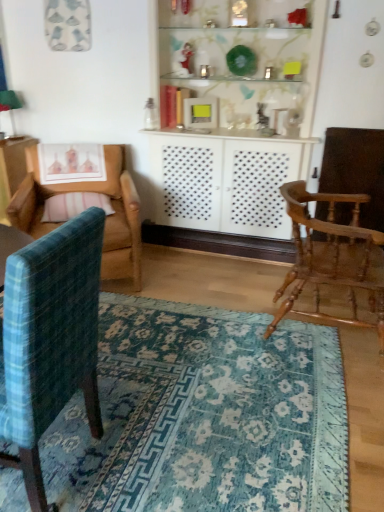
Where is `blue woven rug at lower center`? This screenshot has height=512, width=384. blue woven rug at lower center is located at coordinates (204, 416).

Image resolution: width=384 pixels, height=512 pixels. What do you see at coordinates (106, 219) in the screenshot?
I see `wooden armchair at left, the third chair viewed from the right` at bounding box center [106, 219].

The image size is (384, 512). Describe the element at coordinates (74, 205) in the screenshot. I see `pink striped pillow at left` at that location.

Describe the element at coordinates (333, 256) in the screenshot. The width and height of the screenshot is (384, 512). I see `wooden rocking chair at right, the 1th chair positioned from the right` at that location.

Image resolution: width=384 pixels, height=512 pixels. Find the location of `teal plaid chair at left, which is the second chair in right-to-left order`. teal plaid chair at left, which is the second chair in right-to-left order is located at coordinates (50, 340).

Where is `blue woven rug at lower center`? blue woven rug at lower center is located at coordinates (204, 416).

Considering the sizes of pink striped pillow at left and blue woven rug at lower center in the image, is pink striped pillow at left wider or thinner than blue woven rug at lower center?

In the image, pink striped pillow at left appears to be more narrow than blue woven rug at lower center.

From a real-world perspective, is pink striped pillow at left located beneath blue woven rug at lower center?

Actually, pink striped pillow at left is physically above blue woven rug at lower center in the real world.

From the image's perspective, is pink striped pillow at left beneath blue woven rug at lower center?

No, from the image's perspective, pink striped pillow at left is not beneath blue woven rug at lower center.

Is blue woven rug at lower center surrounded by pink striped pillow at left?

No, blue woven rug at lower center is not inside pink striped pillow at left.

Find the location of a particular element. chair that is the 1st one above the blue woven rug at lower center (from a real-world perspective) is located at coordinates (333, 256).

Does wooden rocking chair at right, placed as the third chair when sorted from left to right, have a larger size compared to blue woven rug at lower center?

Indeed, wooden rocking chair at right, placed as the third chair when sorted from left to right, has a larger size compared to blue woven rug at lower center.

Between wooden rocking chair at right, the 1th chair positioned from the right, and blue woven rug at lower center, which one appears on the right side from the viewer's perspective?

From the viewer's perspective, wooden rocking chair at right, the 1th chair positioned from the right, appears more on the right side.

From a real-world perspective, is wooden rocking chair at right, the 1th chair positioned from the right, positioned above or below blue woven rug at lower center?

From a real-world perspective, wooden rocking chair at right, the 1th chair positioned from the right, is physically above blue woven rug at lower center.

Considering the relative sizes of wooden rocking chair at right, the 1th chair positioned from the right, and wooden armchair at left, the third chair viewed from the right, in the image provided, is wooden rocking chair at right, the 1th chair positioned from the right, taller than wooden armchair at left, the third chair viewed from the right,?

In fact, wooden rocking chair at right, the 1th chair positioned from the right, may be shorter than wooden armchair at left, the third chair viewed from the right.

Looking at this image, who is smaller, wooden rocking chair at right, placed as the third chair when sorted from left to right, or wooden armchair at left, the third chair viewed from the right?

With smaller size is wooden rocking chair at right, placed as the third chair when sorted from left to right.

Is point (304, 191) closer or farther from the camera than point (118, 253)?

Point (304, 191) is positioned closer to the camera compared to point (118, 253).

In the image, is wooden rocking chair at right, the 1th chair positioned from the right, on the left side or the right side of wooden armchair at left, acting as the first chair starting from the left?

In the image, wooden rocking chair at right, the 1th chair positioned from the right, appears on the right side of wooden armchair at left, acting as the first chair starting from the left.

From the image's perspective, which one is positioned lower, wooden rocking chair at right, the 1th chair positioned from the right, or pink striped pillow at left?

wooden rocking chair at right, the 1th chair positioned from the right, from the image's perspective.

Considering the relative sizes of wooden rocking chair at right, the 1th chair positioned from the right, and pink striped pillow at left in the image provided, is wooden rocking chair at right, the 1th chair positioned from the right, shorter than pink striped pillow at left?

No, wooden rocking chair at right, the 1th chair positioned from the right, is not shorter than pink striped pillow at left.

Considering the relative sizes of wooden rocking chair at right, the 1th chair positioned from the right, and pink striped pillow at left in the image provided, is wooden rocking chair at right, the 1th chair positioned from the right, thinner than pink striped pillow at left?

Incorrect, the width of wooden rocking chair at right, the 1th chair positioned from the right, is not less than that of pink striped pillow at left.

From a real-world perspective, is wooden rocking chair at right, placed as the third chair when sorted from left to right, positioned above or below pink striped pillow at left?

wooden rocking chair at right, placed as the third chair when sorted from left to right, is situated lower than pink striped pillow at left in the real world.

Based on their sizes in the image, would you say blue woven rug at lower center is bigger or smaller than wooden rocking chair at right, the 1th chair positioned from the right?

Considering their sizes, blue woven rug at lower center takes up less space than wooden rocking chair at right, the 1th chair positioned from the right.

Considering the relative sizes of blue woven rug at lower center and wooden rocking chair at right, the 1th chair positioned from the right, in the image provided, is blue woven rug at lower center taller than wooden rocking chair at right, the 1th chair positioned from the right,?

Incorrect, the height of blue woven rug at lower center is not larger of that of wooden rocking chair at right, the 1th chair positioned from the right.

Consider the image. Can you confirm if blue woven rug at lower center is thinner than wooden rocking chair at right, placed as the third chair when sorted from left to right?

In fact, blue woven rug at lower center might be wider than wooden rocking chair at right, placed as the third chair when sorted from left to right.

Between point (327, 327) and point (321, 263), which one is positioned in front?

Positioned in front is point (321, 263).

Looking at this image, from a real-world perspective, which object rests below the other?

From a 3D spatial view, pink striped pillow at left is below.

From the image's perspective, is teal plaid chair at left, placed as the 2th chair when sorted from left to right, beneath pink striped pillow at left?

Indeed, from the image's perspective, teal plaid chair at left, placed as the 2th chair when sorted from left to right, is shown beneath pink striped pillow at left.

Which object is positioned more to the right, teal plaid chair at left, placed as the 2th chair when sorted from left to right, or pink striped pillow at left?

Positioned to the right is teal plaid chair at left, placed as the 2th chair when sorted from left to right.

Considering the relative sizes of teal plaid chair at left, which is the second chair in right-to-left order, and pink striped pillow at left in the image provided, is teal plaid chair at left, which is the second chair in right-to-left order, wider than pink striped pillow at left?

Yes.

Between wooden armchair at left, the third chair viewed from the right, and wooden rocking chair at right, the 1th chair positioned from the right, which one has more height?

With more height is wooden armchair at left, the third chair viewed from the right.

Does wooden armchair at left, acting as the first chair starting from the left, turn towards wooden rocking chair at right, the 1th chair positioned from the right?

No.

Looking at this image, can you confirm if wooden armchair at left, the third chair viewed from the right, is thinner than wooden rocking chair at right, the 1th chair positioned from the right?

In fact, wooden armchair at left, the third chair viewed from the right, might be wider than wooden rocking chair at right, the 1th chair positioned from the right.

Is point (116, 158) positioned after point (334, 200)?

Yes, point (116, 158) is farther from viewer.

Identify the location of pillow that is above the blue woven rug at lower center (from the image's perspective). The image size is (384, 512). (74, 205).

Where is `chair that is on the right side of blue woven rug at lower center`? This screenshot has height=512, width=384. chair that is on the right side of blue woven rug at lower center is located at coordinates (333, 256).

In the scene shown: From the image, which object appears to be nearer to blue woven rug at lower center, wooden rocking chair at right, the 1th chair positioned from the right, or pink striped pillow at left?

wooden rocking chair at right, the 1th chair positioned from the right, is closer to blue woven rug at lower center.

Looking at the image, which one is located further to teal plaid chair at left, placed as the 2th chair when sorted from left to right, blue woven rug at lower center or pink striped pillow at left?

pink striped pillow at left is further to teal plaid chair at left, placed as the 2th chair when sorted from left to right.

Which object lies nearer to the anchor point teal plaid chair at left, placed as the 2th chair when sorted from left to right, wooden rocking chair at right, the 1th chair positioned from the right, or pink striped pillow at left?

Based on the image, wooden rocking chair at right, the 1th chair positioned from the right, appears to be nearer to teal plaid chair at left, placed as the 2th chair when sorted from left to right.

Which object lies further to the anchor point wooden armchair at left, the third chair viewed from the right, wooden rocking chair at right, the 1th chair positioned from the right, or pink striped pillow at left?

wooden rocking chair at right, the 1th chair positioned from the right, lies further to wooden armchair at left, the third chair viewed from the right, than the other object.

Based on their spatial positions, is pink striped pillow at left or teal plaid chair at left, placed as the 2th chair when sorted from left to right, closer to blue woven rug at lower center?

The object closer to blue woven rug at lower center is teal plaid chair at left, placed as the 2th chair when sorted from left to right.

When comparing their distances from teal plaid chair at left, which is the second chair in right-to-left order, does pink striped pillow at left or blue woven rug at lower center seem closer?

blue woven rug at lower center lies closer to teal plaid chair at left, which is the second chair in right-to-left order, than the other object.

Estimate the real-world distances between objects in this image. Which object is closer to blue woven rug at lower center, pink striped pillow at left or wooden rocking chair at right, the 1th chair positioned from the right?

wooden rocking chair at right, the 1th chair positioned from the right, lies closer to blue woven rug at lower center than the other object.

Looking at the image, which one is located further to blue woven rug at lower center, wooden rocking chair at right, placed as the third chair when sorted from left to right, or wooden armchair at left, acting as the first chair starting from the left?

Based on the image, wooden armchair at left, acting as the first chair starting from the left, appears to be further to blue woven rug at lower center.

Identify the location of mat situated between teal plaid chair at left, which is the second chair in right-to-left order, and wooden rocking chair at right, placed as the third chair when sorted from left to right, from left to right. (204, 416).

The height and width of the screenshot is (512, 384). I want to click on chair situated between wooden armchair at left, the third chair viewed from the right, and wooden rocking chair at right, placed as the third chair when sorted from left to right, from left to right, so click(x=50, y=340).

Find the location of a particular element. The height and width of the screenshot is (512, 384). mat between wooden armchair at left, acting as the first chair starting from the left, and wooden rocking chair at right, the 1th chair positioned from the right, from left to right is located at coordinates (204, 416).

Where is `mat located between teal plaid chair at left, placed as the 2th chair when sorted from left to right, and wooden armchair at left, acting as the first chair starting from the left, in the depth direction`? This screenshot has height=512, width=384. mat located between teal plaid chair at left, placed as the 2th chair when sorted from left to right, and wooden armchair at left, acting as the first chair starting from the left, in the depth direction is located at coordinates (204, 416).